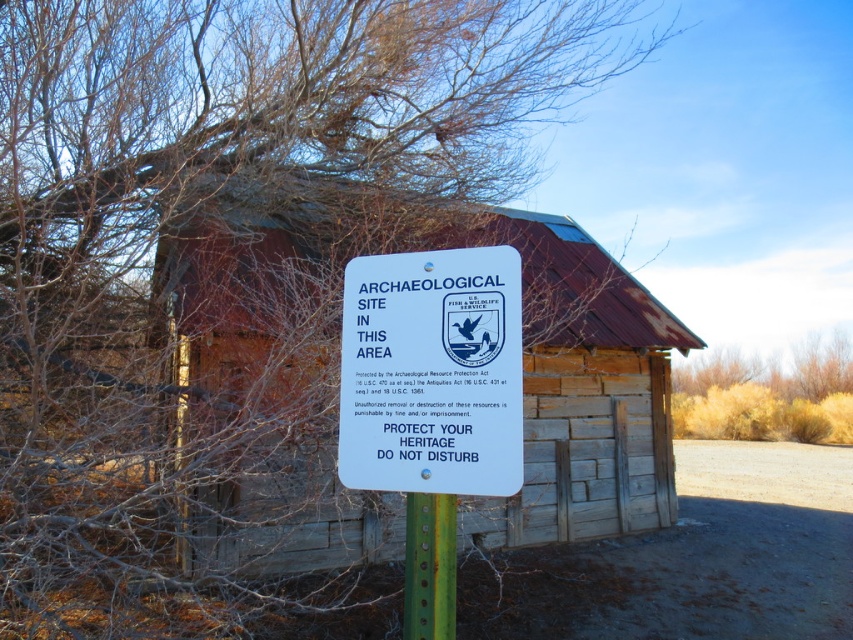
Question: Which point is farther to the camera?

Choices:
 (A) green painted metal post at center
 (B) white plastic sign at center
 (C) brown dry bush at center

Answer: (C)

Question: Is the position of weathered wood hut at center less distant than that of brown dry bush at center?

Choices:
 (A) no
 (B) yes

Answer: (B)

Question: Can you confirm if weathered wood hut at center is positioned to the left of brown dry bush at center?

Choices:
 (A) no
 (B) yes

Answer: (B)

Question: Which of the following is the closest to the observer?

Choices:
 (A) click(x=541, y=433)
 (B) click(x=813, y=339)
 (C) click(x=407, y=499)
 (D) click(x=416, y=333)

Answer: (D)

Question: Which point is closer to the camera taking this photo?

Choices:
 (A) (368, 352)
 (B) (822, 371)

Answer: (A)

Question: Is weathered wood hut at center positioned behind white plastic sign at center?

Choices:
 (A) no
 (B) yes

Answer: (B)